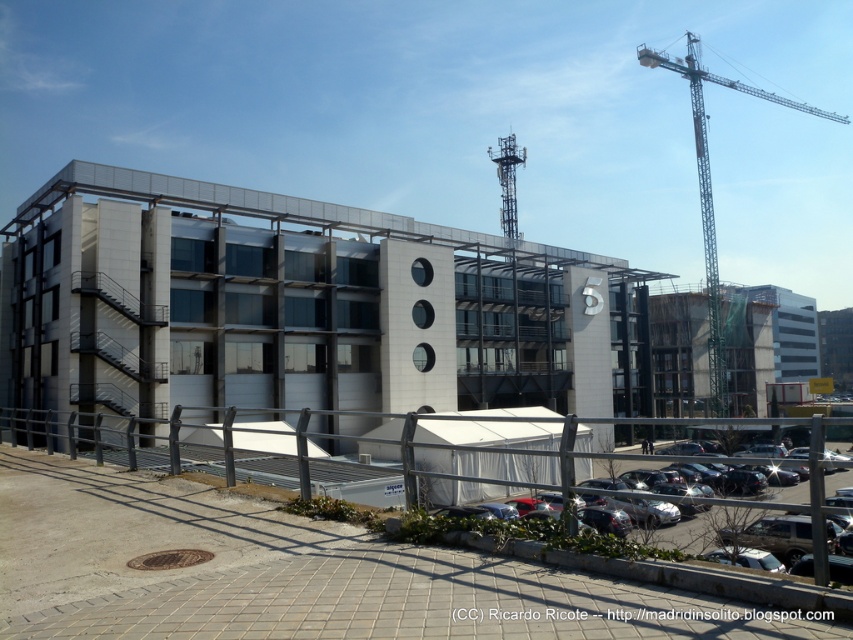
Is green metallic crane at upper right shorter than black asphalt parking lot at lower right?

Incorrect, green metallic crane at upper right's height does not fall short of black asphalt parking lot at lower right's.

Who is higher up, green metallic crane at upper right or black asphalt parking lot at lower right?

green metallic crane at upper right

Does point (695, 61) come in front of point (815, 438)?

That is False.

Locate an element on the screen. green metallic crane at upper right is located at coordinates point(711,188).

This screenshot has width=853, height=640. What do you see at coordinates (294, 573) in the screenshot?
I see `white tent at center` at bounding box center [294, 573].

Who is lower down, white tent at center or green metallic crane at upper right?

white tent at center is below.

Where is `white tent at center`? white tent at center is located at coordinates (294, 573).

Is white tent at center thinner than black asphalt parking lot at lower right?

Indeed, white tent at center has a lesser width compared to black asphalt parking lot at lower right.

Can you confirm if white tent at center is smaller than black asphalt parking lot at lower right?

Yes, white tent at center is smaller than black asphalt parking lot at lower right.

I want to click on white tent at center, so click(294, 573).